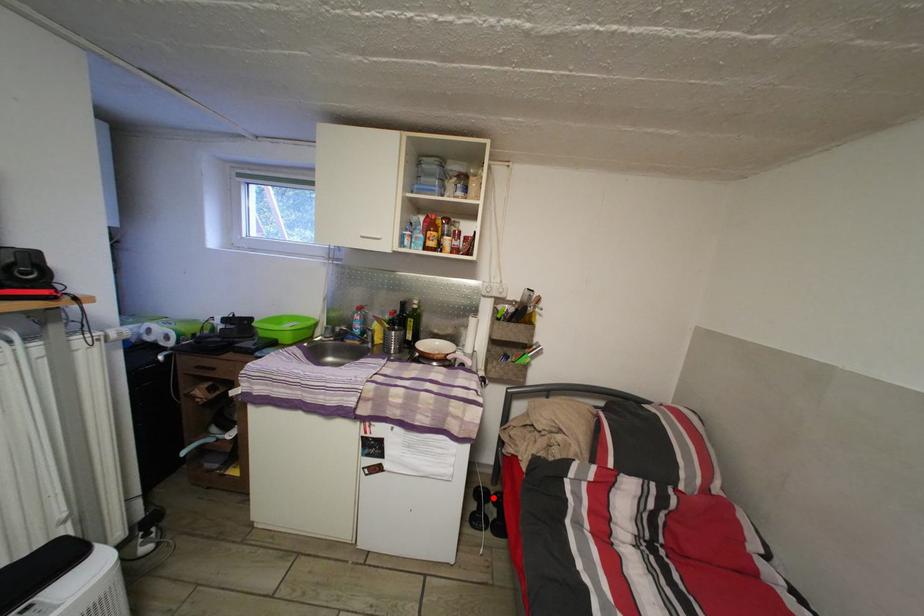
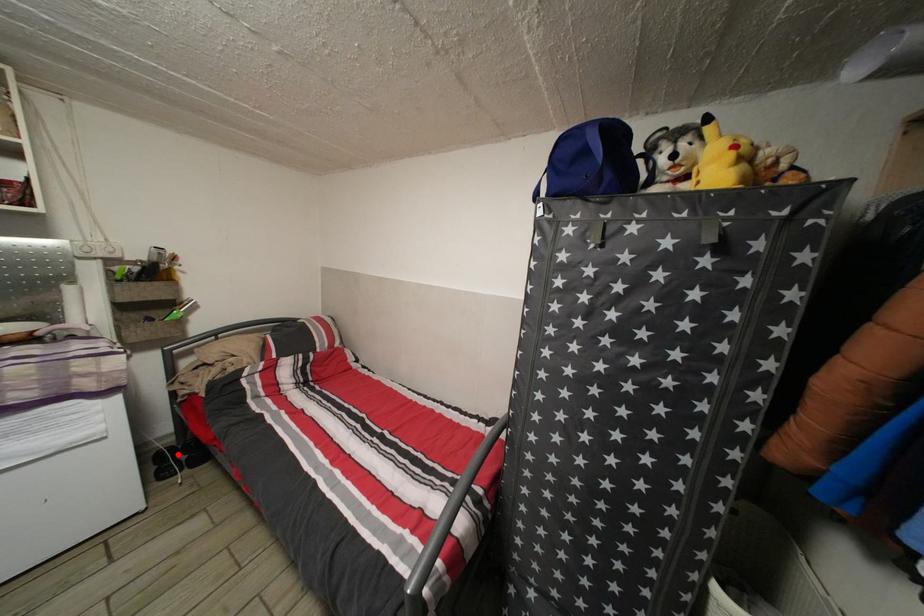
I am providing you with two images of the same scene from different viewpoints. A red point is marked on the first image and another point is marked on the second image. Do the highlighted points in image1 and image2 indicate the same real-world spot?

Yes